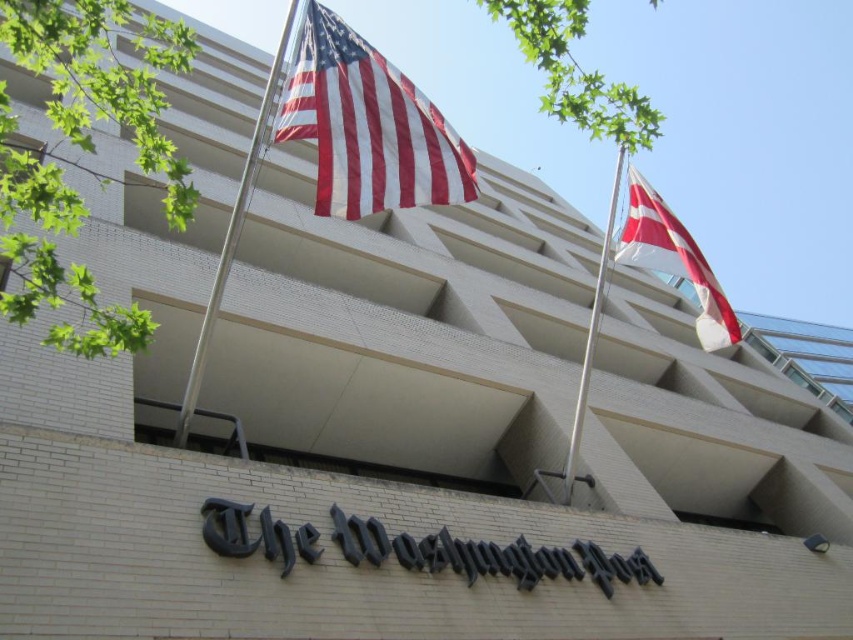
Question: Among these objects, which one is nearest to the camera?

Choices:
 (A) white cotton flag at upper right
 (B) metallic silver flag pole at upper center
 (C) red-white striped fabric flag at upper center

Answer: (C)

Question: Which object appears closest to the camera in this image?

Choices:
 (A) silver metallic flag pole at right
 (B) white cotton flag at upper right

Answer: (A)

Question: Is metallic silver flag pole at upper center bigger than silver metallic flag pole at right?

Choices:
 (A) yes
 (B) no

Answer: (B)

Question: Can you confirm if white cotton flag at upper right is thinner than silver metallic flag pole at right?

Choices:
 (A) no
 (B) yes

Answer: (A)

Question: Can you confirm if red-white striped fabric flag at upper center is thinner than silver metallic flag pole at right?

Choices:
 (A) no
 (B) yes

Answer: (B)

Question: Estimate the real-world distances between objects in this image. Which object is closer to the white cotton flag at upper right?

Choices:
 (A) red-white striped fabric flag at upper center
 (B) metallic silver flag pole at upper center

Answer: (A)